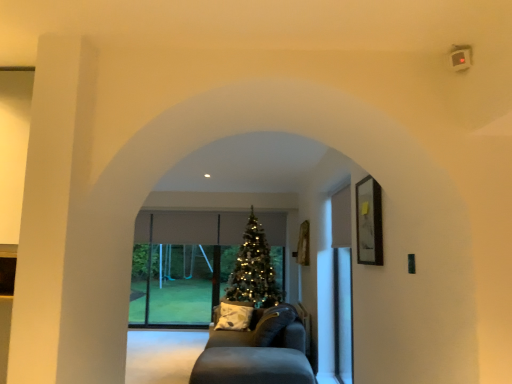
Question: Is point (243, 269) positioned closer to the camera than point (197, 258)?

Choices:
 (A) farther
 (B) closer

Answer: (B)

Question: From a real-world perspective, is shiny gold christmas tree at center physically located above or below transparent glass door at center?

Choices:
 (A) above
 (B) below

Answer: (A)

Question: Which object is positioned closest to the shiny gold christmas tree at center?

Choices:
 (A) wooden framed picture at right
 (B) dark gray fabric couch at center
 (C) transparent glass screen door at right
 (D) transparent glass door at center

Answer: (D)

Question: Considering the real-world distances, which object is farthest from the shiny gold christmas tree at center?

Choices:
 (A) transparent glass door at center
 (B) dark gray fabric couch at center
 (C) transparent glass screen door at right
 (D) wooden framed picture at right

Answer: (D)